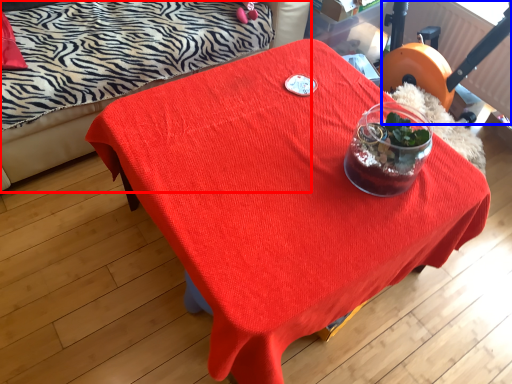
Question: Among these objects, which one is farthest to the camera, studio couch (highlighted by a red box) or swivel chair (highlighted by a blue box)?

Choices:
 (A) studio couch
 (B) swivel chair

Answer: (B)